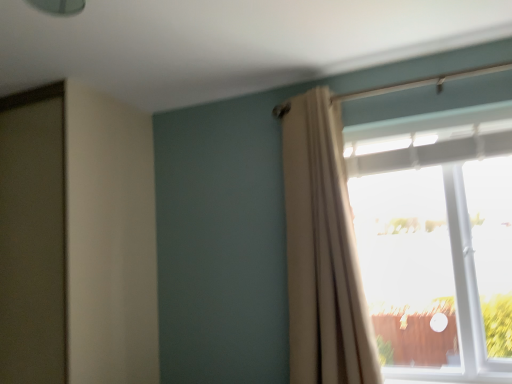
Describe the element at coordinates (322, 250) in the screenshot. Image resolution: width=512 pixels, height=384 pixels. I see `white sheer curtain at upper right` at that location.

This screenshot has height=384, width=512. Identify the location of white sheer curtain at upper right. (322, 250).

What do you see at coordinates (435, 238) in the screenshot?
I see `transparent glass window at upper right` at bounding box center [435, 238].

You are a GUI agent. You are given a task and a screenshot of the screen. Output one action in this format:
    pyautogui.click(x=<x>, y=<y>)
    Task: Click on the transparent glass window at upper right
    This screenshot has height=384, width=512.
    Given the screenshot: What is the action you would take?
    pyautogui.click(x=435, y=238)

In order to face transparent glass window at upper right, should I rotate leftwards or rightwards?

Rotate your view right by about 23.355°.

I want to click on white sheer curtain at upper right, so click(322, 250).

Based on the photo, is transparent glass window at upper right at the left side of white sheer curtain at upper right?

In fact, transparent glass window at upper right is to the right of white sheer curtain at upper right.

Considering the positions of objects transparent glass window at upper right and white sheer curtain at upper right in the image provided, who is in front, transparent glass window at upper right or white sheer curtain at upper right?

white sheer curtain at upper right is more forward.

Is point (507, 222) positioned before point (290, 377)?

No.

From the image's perspective, is transparent glass window at upper right above white sheer curtain at upper right?

No, from the image's perspective, transparent glass window at upper right is not on top of white sheer curtain at upper right.

From a real-world perspective, does transparent glass window at upper right stand above white sheer curtain at upper right?

Actually, transparent glass window at upper right is physically below white sheer curtain at upper right in the real world.

Which object is thinner, transparent glass window at upper right or white sheer curtain at upper right?

white sheer curtain at upper right.

Is transparent glass window at upper right taller or shorter than white sheer curtain at upper right?

Considering their sizes, transparent glass window at upper right has less height than white sheer curtain at upper right.

Based on their sizes in the image, would you say transparent glass window at upper right is bigger or smaller than white sheer curtain at upper right?

In the image, transparent glass window at upper right appears to be larger than white sheer curtain at upper right.

Is white sheer curtain at upper right inside transparent glass window at upper right?

That's incorrect, white sheer curtain at upper right is not inside transparent glass window at upper right.

Are transparent glass window at upper right and white sheer curtain at upper right beside each other?

transparent glass window at upper right and white sheer curtain at upper right are not in contact.

Does transparent glass window at upper right turn towards white sheer curtain at upper right?

A: Yes, transparent glass window at upper right faces towards white sheer curtain at upper right.

I want to click on window behind the white sheer curtain at upper right, so click(x=435, y=238).

Is white sheer curtain at upper right at the right side of transparent glass window at upper right?

In fact, white sheer curtain at upper right is to the left of transparent glass window at upper right.

Is white sheer curtain at upper right closer to camera compared to transparent glass window at upper right?

Yes, it is.

Which is more distant, (314, 233) or (494, 120)?

The point (314, 233) is farther.

From the image's perspective, is white sheer curtain at upper right located above transparent glass window at upper right?

Yes, from the image's perspective, white sheer curtain at upper right is on top of transparent glass window at upper right.

From a real-world perspective, is white sheer curtain at upper right physically located above or below transparent glass window at upper right?

Clearly, from a real-world perspective, white sheer curtain at upper right is above transparent glass window at upper right.

In terms of width, does white sheer curtain at upper right look wider or thinner when compared to transparent glass window at upper right?

Considering their sizes, white sheer curtain at upper right looks slimmer than transparent glass window at upper right.

Considering the sizes of objects white sheer curtain at upper right and transparent glass window at upper right in the image provided, who is shorter, white sheer curtain at upper right or transparent glass window at upper right?

transparent glass window at upper right is shorter.

Based on the photo, which of these two, white sheer curtain at upper right or transparent glass window at upper right, is smaller?

Smaller between the two is white sheer curtain at upper right.

Does white sheer curtain at upper right contain transparent glass window at upper right?

No, transparent glass window at upper right is not surrounded by white sheer curtain at upper right.

Is white sheer curtain at upper right in contact with transparent glass window at upper right?

No, white sheer curtain at upper right is not beside transparent glass window at upper right.

Is white sheer curtain at upper right facing away from transparent glass window at upper right?

white sheer curtain at upper right is not turned away from transparent glass window at upper right.

What's the angular difference between white sheer curtain at upper right and transparent glass window at upper right's facing directions?

The facing directions of white sheer curtain at upper right and transparent glass window at upper right are 0.915 degrees apart.

This screenshot has width=512, height=384. I want to click on window below the white sheer curtain at upper right (from a real-world perspective), so click(435, 238).

In order to click on window located behind the white sheer curtain at upper right in this screenshot , I will do `click(435, 238)`.

Locate an element on the screen. The height and width of the screenshot is (384, 512). curtain located on the left of transparent glass window at upper right is located at coordinates point(322,250).